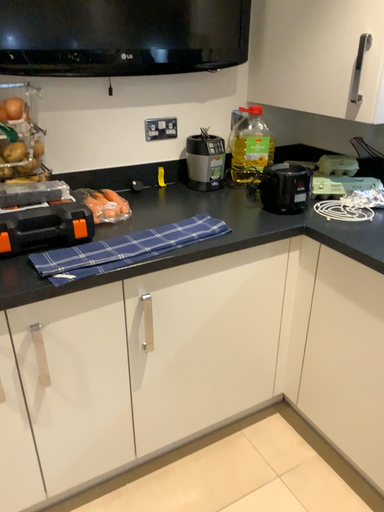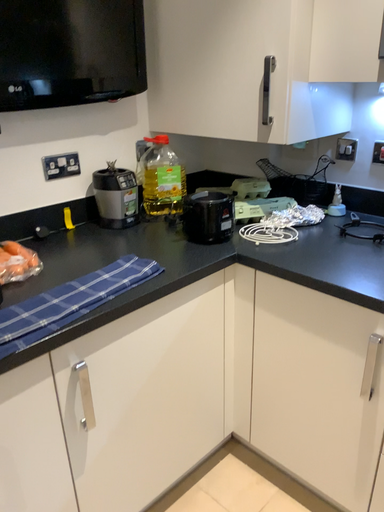
Question: How did the camera likely rotate when shooting the video?

Choices:
 (A) rotated left
 (B) rotated right

Answer: (B)